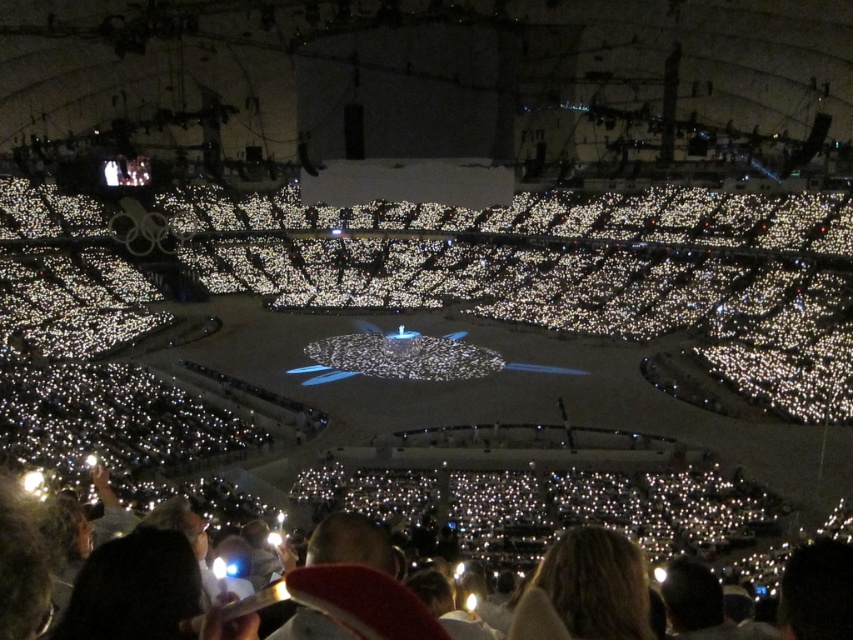
You are standing at the edge of the arena looking towards the stage. There is a white paper at lower center marked by point (608,508). Can you see the white paper at lower center from your current position?

Yes, the white paper at lower center is located at point (608,508), which is in the lower center of the arena. Since you are at the edge looking towards the stage, the white paper at lower center would be directly in your line of sight.

You are standing at the front of the arena facing the stage. You notice two points marked in the image. Which point, point [447,486] or point [541,628], is closer to you?

Point [447,486] is further to the viewer than point [541,628], so the closer point to you is point [541,628].

You are standing at the entrance of the arena and see the white paper at lower center. If you want to walk directly towards it, which direction should you head?

Since the white paper at lower center is located at coordinates point (608, 508), you should head towards the lower center direction to reach it.